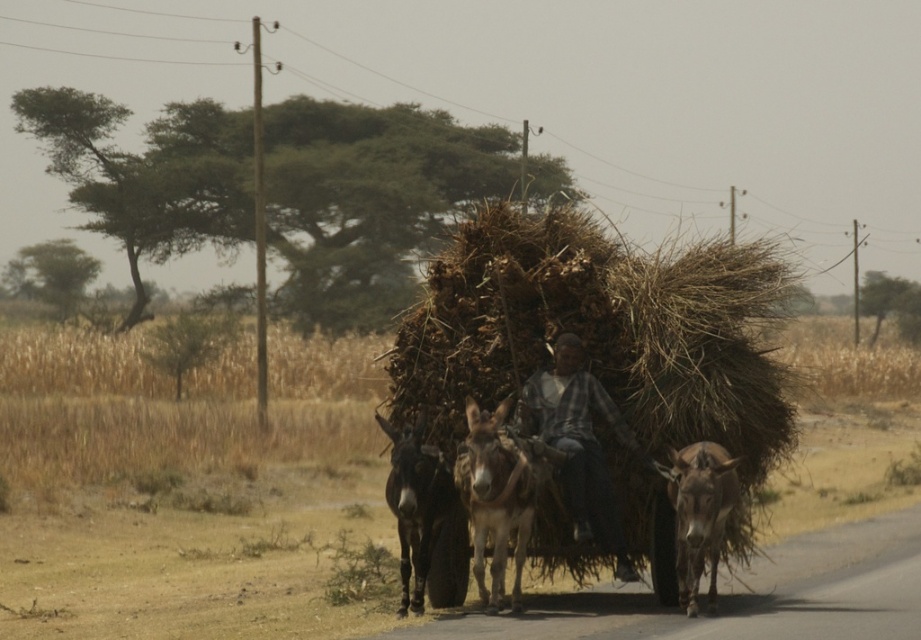
Is point (531, 406) positioned in front of point (476, 529)?

No, (531, 406) is behind (476, 529).

Locate an element on the screen. plaid fabric shirt at center is located at coordinates (578, 444).

Does plaid fabric shirt at center appear under brown rough textured mule at center?

No, plaid fabric shirt at center is not below brown rough textured mule at center.

Does point (555, 364) come farther from viewer compared to point (714, 520)?

Yes, it is behind point (714, 520).

Who is more forward, (601,451) or (717,484)?

Point (717,484) is more forward.

The width and height of the screenshot is (921, 640). Find the location of `plaid fabric shirt at center`. plaid fabric shirt at center is located at coordinates (578, 444).

Is plaid fabric shirt at center below dark brown fur mule at center?

Incorrect, plaid fabric shirt at center is not positioned below dark brown fur mule at center.

Which of these two, plaid fabric shirt at center or dark brown fur mule at center, stands taller?

Standing taller between the two is plaid fabric shirt at center.

Does point (579, 496) lie behind point (392, 442)?

Yes, it is.

The height and width of the screenshot is (640, 921). Identify the location of plaid fabric shirt at center. (578, 444).